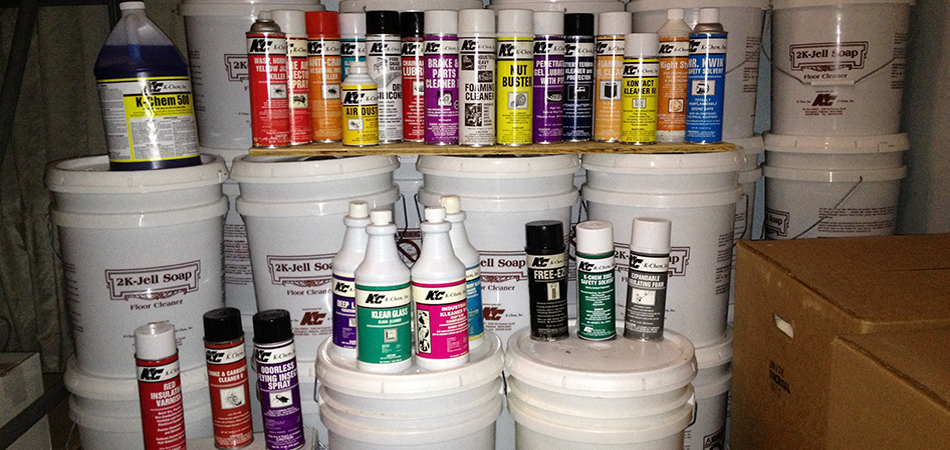
Locate an element on the screen. This screenshot has height=450, width=950. jug is located at coordinates (121, 60).